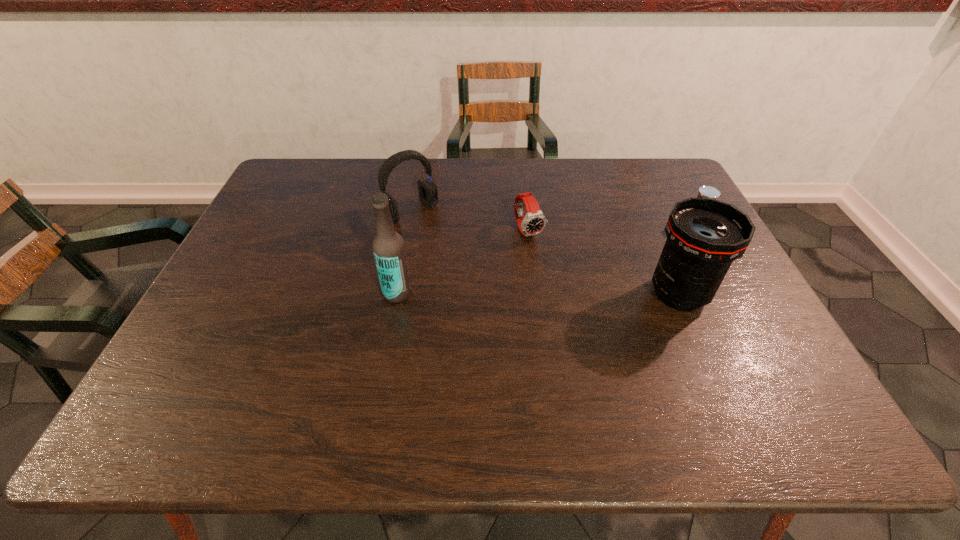
At what (x,y) coordinates should I click in order to perform the action: click on free space on the desktop that is between the beer bottle and the fourth object from left to right and is positioned on the label side of the rightmost object. Please return your answer as a coordinate pair (x, y). The image size is (960, 540). Looking at the image, I should click on (560, 294).

This screenshot has width=960, height=540. What are the coordinates of `vacant space on the desktop that is between the tallest object and the telephoto lens and is positioned on the face of the third object from right to left` in the screenshot? It's located at (571, 294).

This screenshot has height=540, width=960. I want to click on free space on the desktop that is between the beer bottle and the telephoto lens and is positioned on the headband of the headset, so click(496, 293).